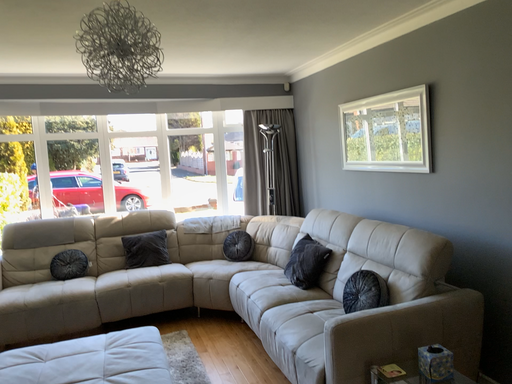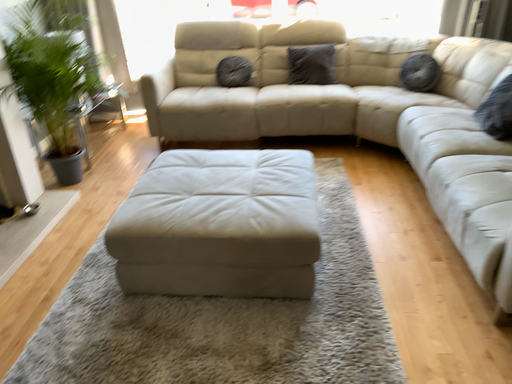
Question: Which way did the camera rotate in the video?

Choices:
 (A) rotated downward
 (B) rotated upward

Answer: (A)